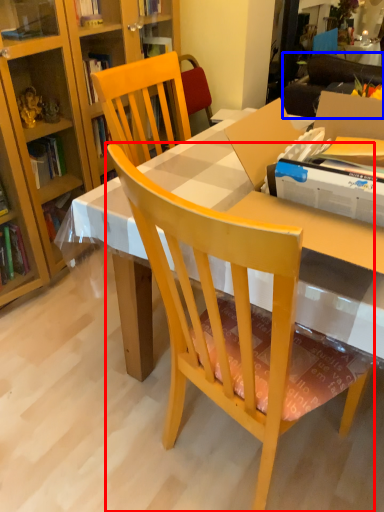
Question: Which of the following is the closest to the observer, chair (highlighted by a red box) or studio couch (highlighted by a blue box)?

Choices:
 (A) chair
 (B) studio couch

Answer: (A)